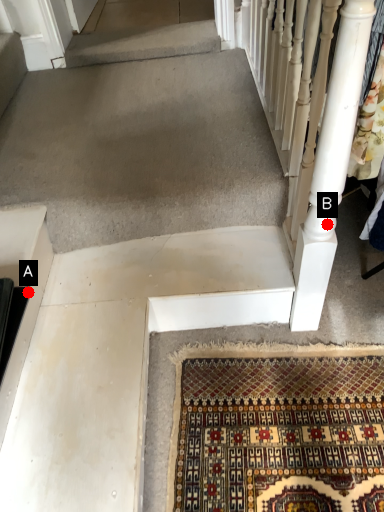
Question: Two points are circled on the image, labeled by A and B beside each circle. Among these points, which one is farthest from the camera?

Choices:
 (A) A is further
 (B) B is further

Answer: (A)